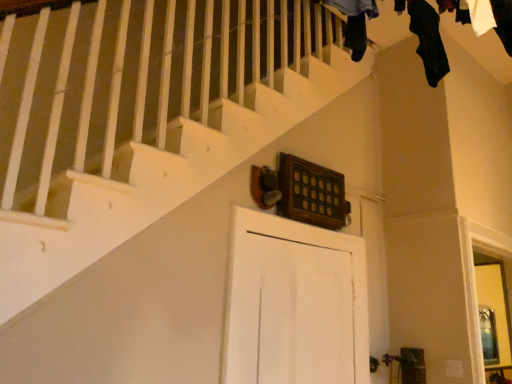
Question: Is black fabric at upper right, acting as the 1th clothing starting from the right, further to camera compared to black fabric at upper center, positioned as the first clothing in left-to-right order?

Choices:
 (A) yes
 (B) no

Answer: (A)

Question: Is black fabric at upper right, acting as the 1th clothing starting from the right, oriented towards black fabric at upper center, which is counted as the second clothing, starting from the right?

Choices:
 (A) no
 (B) yes

Answer: (A)

Question: Is black fabric at upper right, the 1th clothing in the back-to-front sequence, located outside black fabric at upper center, arranged as the second clothing when viewed from the back?

Choices:
 (A) no
 (B) yes

Answer: (B)

Question: Considering the relative sizes of black fabric at upper right, the 2th clothing from the front, and black fabric at upper center, the 1th clothing viewed from the front, in the image provided, is black fabric at upper right, the 2th clothing from the front, bigger than black fabric at upper center, the 1th clothing viewed from the front,?

Choices:
 (A) yes
 (B) no

Answer: (A)

Question: From a real-world perspective, is black fabric at upper right, arranged as the 2th clothing when viewed from the left, positioned over black fabric at upper center, positioned as the first clothing in left-to-right order, based on gravity?

Choices:
 (A) yes
 (B) no

Answer: (A)

Question: Do you think black fabric at upper right, acting as the 1th clothing starting from the right, is within black fabric at upper center, the 1th clothing viewed from the front, or outside of it?

Choices:
 (A) outside
 (B) inside

Answer: (A)

Question: Is black fabric at upper right, the 2th clothing from the front, taller or shorter than black fabric at upper center, positioned as the first clothing in left-to-right order?

Choices:
 (A) tall
 (B) short

Answer: (A)

Question: In the image, is black fabric at upper right, the 1th clothing in the back-to-front sequence, positioned in front of or behind black fabric at upper center, the 1th clothing viewed from the front?

Choices:
 (A) front
 (B) behind

Answer: (B)

Question: From the image's perspective, is black fabric at upper right, the 2th clothing from the front, positioned above or below black fabric at upper center, positioned as the first clothing in left-to-right order?

Choices:
 (A) above
 (B) below

Answer: (A)

Question: Is black fabric at upper center, which is counted as the second clothing, starting from the right, taller or shorter than white matte door at center?

Choices:
 (A) short
 (B) tall

Answer: (A)

Question: Relative to white matte door at center, is black fabric at upper center, which is counted as the second clothing, starting from the right, in front or behind?

Choices:
 (A) behind
 (B) front

Answer: (B)

Question: Based on their positions, is black fabric at upper center, which is counted as the second clothing, starting from the right, located to the left or right of white matte door at center?

Choices:
 (A) left
 (B) right

Answer: (B)

Question: From a real-world perspective, relative to white matte door at center, is black fabric at upper center, which is counted as the second clothing, starting from the right, vertically above or below?

Choices:
 (A) above
 (B) below

Answer: (A)

Question: Considering the positions of white matte door at center and black fabric at upper center, arranged as the second clothing when viewed from the back, in the image, is white matte door at center wider or thinner than black fabric at upper center, arranged as the second clothing when viewed from the back,?

Choices:
 (A) thin
 (B) wide

Answer: (A)

Question: From a real-world perspective, is white matte door at center physically located above or below black fabric at upper center, positioned as the first clothing in left-to-right order?

Choices:
 (A) above
 (B) below

Answer: (B)